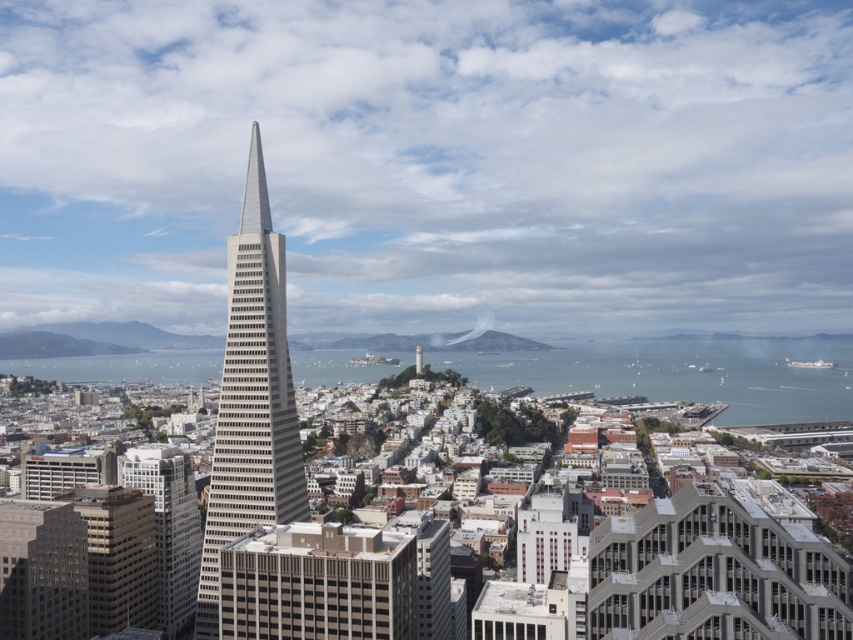
Question: Which object is farther from the camera taking this photo?

Choices:
 (A) gray concrete building at lower left
 (B) matte gray building at lower left
 (C) matte glass skyscraper at lower left
 (D) white concrete tower at center

Answer: (D)

Question: Considering the relative positions of gray concrete building at lower left and white concrete tower at center in the image provided, where is gray concrete building at lower left located with respect to white concrete tower at center?

Choices:
 (A) above
 (B) below

Answer: (B)

Question: Is matte glass skyscraper at lower left in front of white concrete tower at center?

Choices:
 (A) yes
 (B) no

Answer: (A)

Question: Among these objects, which one is nearest to the camera?

Choices:
 (A) blue water at center
 (B) gray concrete skyscraper at center
 (C) gray concrete building at lower left

Answer: (B)

Question: Which point is closer to the camera?

Choices:
 (A) blue water at center
 (B) matte glass skyscraper at lower left
 (C) gray concrete skyscraper at center
 (D) matte gray building at lower left

Answer: (B)

Question: Observing the image, what is the correct spatial positioning of gray concrete building at lower left in reference to white concrete tower at center?

Choices:
 (A) below
 (B) above

Answer: (A)